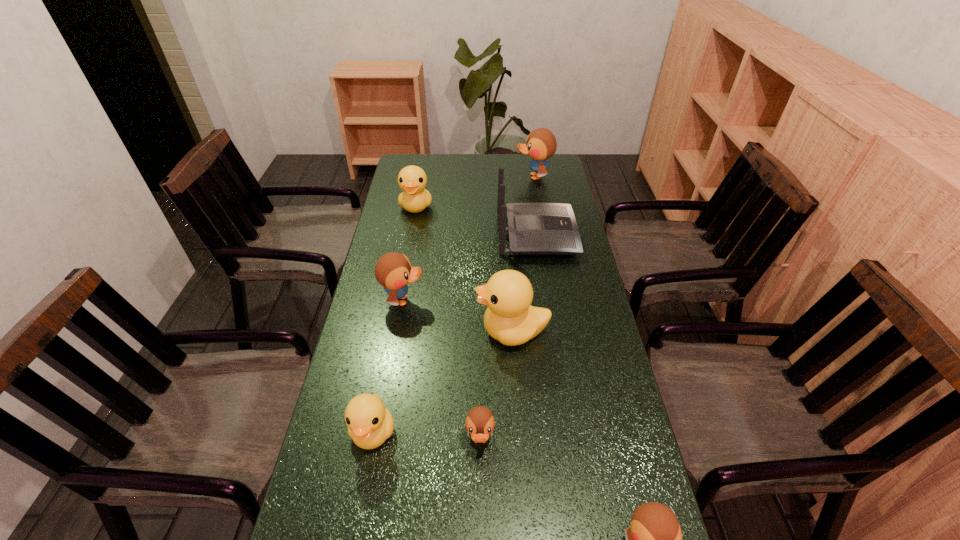
Identify which yellow duck is the second nearest to the nearest blue duck. Please provide its 2D coordinates. Your answer should be formatted as a tuple, i.e. [(x, y)], where the tuple contains the x and y coordinates of a point satisfying the conditions above.

[(369, 423)]

Locate an element on the screen. Image resolution: width=960 pixels, height=540 pixels. yellow duck that is the closest to the smallest yellow duck is located at coordinates click(510, 318).

Image resolution: width=960 pixels, height=540 pixels. I want to click on vacant point that satisfies the following two spatial constraints: 1. on the front-facing side of the farthest object; 2. on the front-facing side of the shortest object, so click(x=580, y=441).

The width and height of the screenshot is (960, 540). Identify the location of free space in the image that satisfies the following two spatial constraints: 1. on the front-facing side of the farthest duck; 2. on the face of the second smallest yellow duck. (539, 206).

You are a GUI agent. You are given a task and a screenshot of the screen. Output one action in this format:
    pyautogui.click(x=<x>, y=<y>)
    Task: Click on the free region that satisfies the following two spatial constraints: 1. on the face of the rightmost yellow duck; 2. on the face of the smallest yellow duck
    
    Given the screenshot: What is the action you would take?
    pyautogui.click(x=519, y=432)

What are the coordinates of `free spot that satisfies the following two spatial constraints: 1. on the front-facing side of the farthest blue duck; 2. on the front-facing side of the second blue duck from left to right` in the screenshot? It's located at (580, 441).